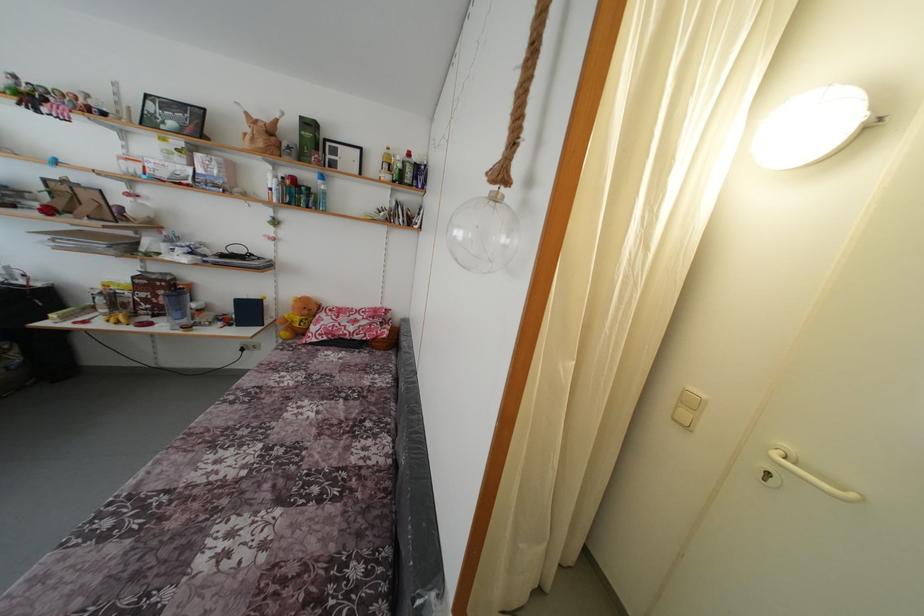
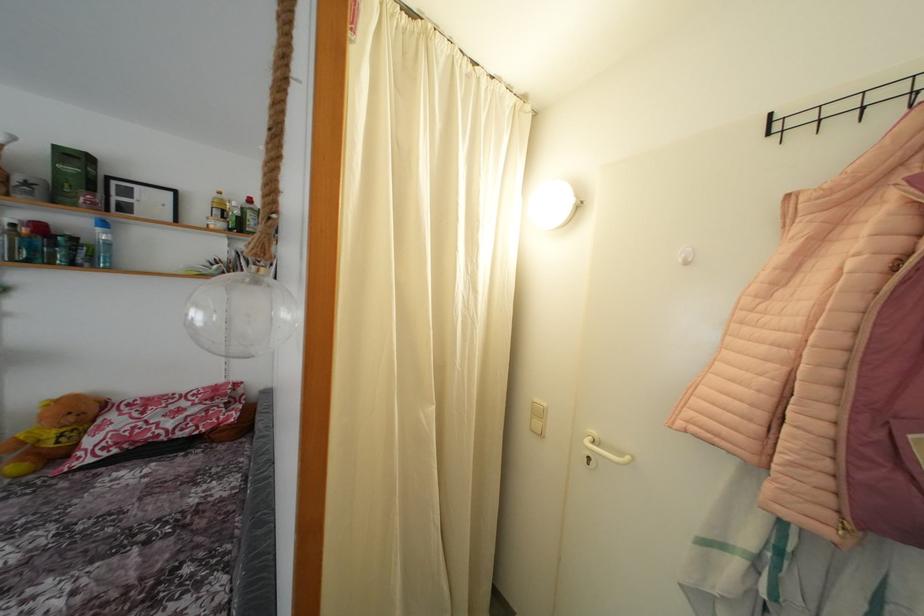
Where in the second image is the point corresponding to (x=324, y=188) from the first image?

(104, 236)